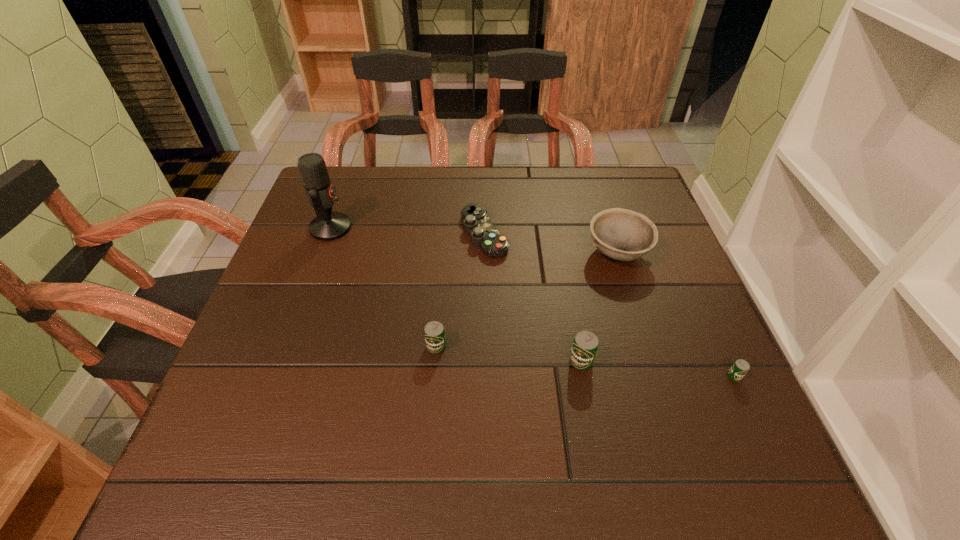
Identify the location of object that is at the far left corner. The image size is (960, 540). (328, 225).

Locate an element on the screen. object present at the near right corner is located at coordinates (739, 369).

The image size is (960, 540). Identify the location of vacant area at the far edge of the desktop. (457, 181).

You are a GUI agent. You are given a task and a screenshot of the screen. Output one action in this format:
    pyautogui.click(x=<x>, y=<y>)
    Task: Click on the free space at the left edge of the desktop
    
    Given the screenshot: What is the action you would take?
    pyautogui.click(x=309, y=252)

In the image, there is a desktop. Identify the location of free space at the right edge. The width and height of the screenshot is (960, 540). (663, 223).

The height and width of the screenshot is (540, 960). In order to click on free space at the far left corner of the desktop in this screenshot , I will do `click(357, 191)`.

The height and width of the screenshot is (540, 960). Identify the location of free space between the second beer can from left to right and the bowl. (599, 307).

Find the location of a particular element. free area in between the rightmost beer can and the second beer can from left to right is located at coordinates (658, 368).

In order to click on free space between the shortest beer can and the bowl in this screenshot , I will do `click(676, 315)`.

You are a GUI agent. You are given a task and a screenshot of the screen. Output one action in this format:
    pyautogui.click(x=<x>, y=<y>)
    Task: Click on the free space between the tallest object and the control
    The image size is (960, 540).
    Given the screenshot: What is the action you would take?
    pyautogui.click(x=407, y=231)